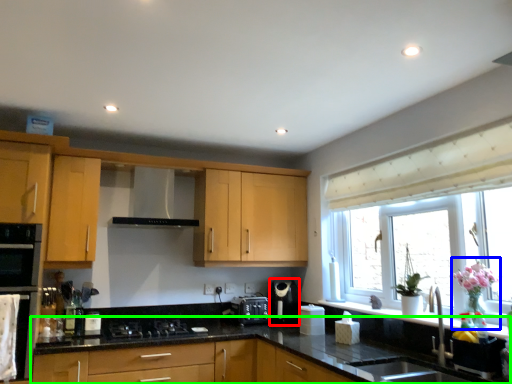
Question: Estimate the real-world distances between objects in this image. Which object is closer to coffee machine (highlighted by a red box), floral arrangement (highlighted by a blue box) or countertop (highlighted by a green box)?

Choices:
 (A) floral arrangement
 (B) countertop

Answer: (B)